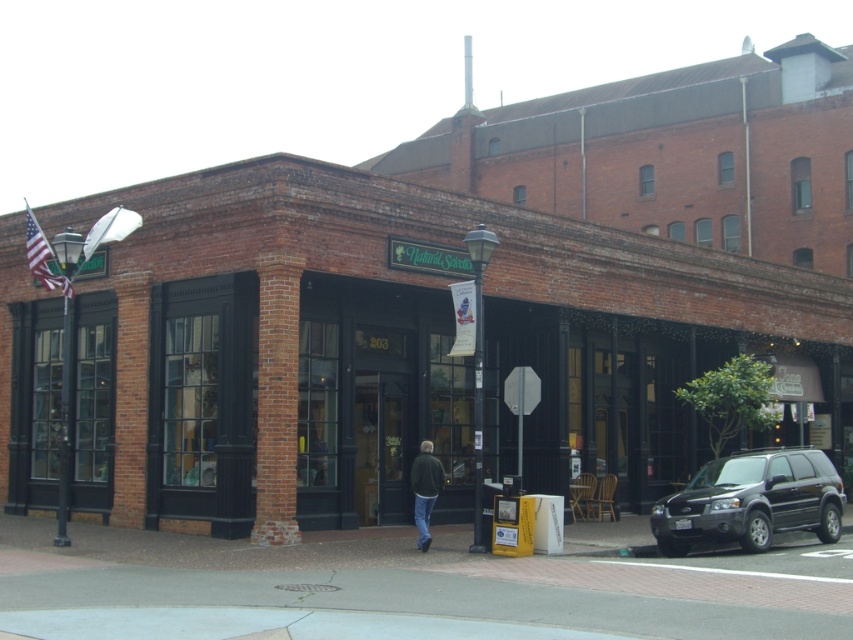
Can you confirm if brick storefront at center is wider than smooth concrete sidewalk at center?

Yes.

Which is above, brick storefront at center or smooth concrete sidewalk at center?

Positioned higher is brick storefront at center.

Locate an element on the screen. This screenshot has width=853, height=640. brick storefront at center is located at coordinates (399, 349).

Can you confirm if brick storefront at center is thinner than black matte suv at lower right?

In fact, brick storefront at center might be wider than black matte suv at lower right.

Does brick storefront at center have a smaller size compared to black matte suv at lower right?

No, brick storefront at center is not smaller than black matte suv at lower right.

This screenshot has height=640, width=853. I want to click on brick storefront at center, so click(399, 349).

This screenshot has height=640, width=853. What do you see at coordinates (413, 586) in the screenshot? I see `smooth concrete sidewalk at center` at bounding box center [413, 586].

Who is more distant from viewer, (38,531) or (757,490)?

Point (38,531)

Who is more forward, [728,561] or [838,536]?

Point [728,561] is in front.

Find the location of a particular element. This screenshot has height=640, width=853. smooth concrete sidewalk at center is located at coordinates (413, 586).